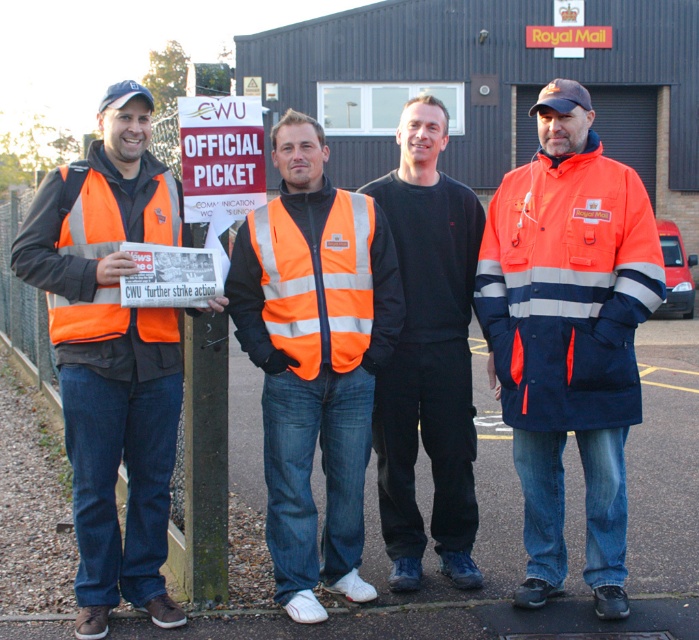
Which is more to the right, orange reflective jacket at center or high visibility orange safety vest at left?

orange reflective jacket at center is more to the right.

The height and width of the screenshot is (640, 699). What are the coordinates of `orange reflective jacket at center` in the screenshot? It's located at (568, 336).

The height and width of the screenshot is (640, 699). In order to click on orange reflective jacket at center in this screenshot , I will do `click(568, 336)`.

Is point (94, 396) in front of point (347, 538)?

Yes, point (94, 396) is closer to viewer.

Measure the distance between matte orange vest at left and orange high-visibility vest at center.

matte orange vest at left is 23.95 inches away from orange high-visibility vest at center.

Where is `matte orange vest at left`? Image resolution: width=699 pixels, height=640 pixels. matte orange vest at left is located at coordinates (110, 353).

Is point (626, 432) positioned in front of point (296, 273)?

No, (626, 432) is behind (296, 273).

Where is `orange reflective jacket at center`? orange reflective jacket at center is located at coordinates (568, 336).